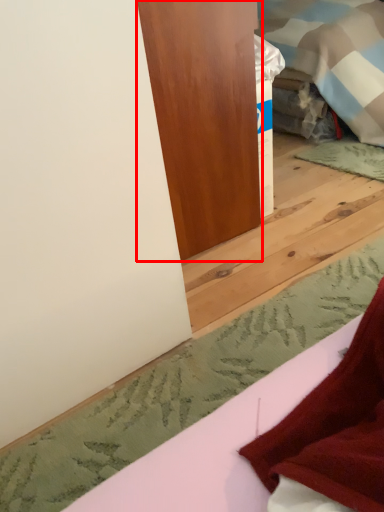
Question: From the image's perspective, where is furniture (annotated by the red box) located in relation to sheet in the image?

Choices:
 (A) above
 (B) below

Answer: (A)